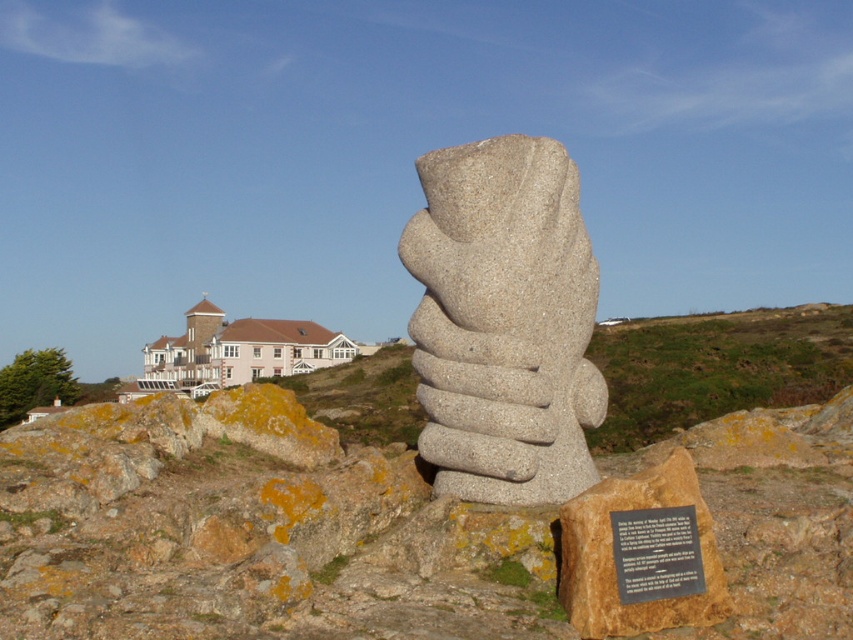
Question: Can you confirm if gray granite sculpture at center is positioned to the right of black paper at center?

Choices:
 (A) no
 (B) yes

Answer: (A)

Question: Can you confirm if gray granite sculpture at center is positioned to the left of black paper at center?

Choices:
 (A) no
 (B) yes

Answer: (B)

Question: Which point is farther from the camera taking this photo?

Choices:
 (A) (641, 577)
 (B) (212, 608)

Answer: (A)

Question: Which is nearer to the brown rock at center?

Choices:
 (A) black paper at center
 (B) gray granite sculpture at center

Answer: (A)

Question: Which object appears farthest from the camera in this image?

Choices:
 (A) black paper at center
 (B) gray granite sculpture at center
 (C) brown rock at center

Answer: (B)

Question: Does gray granite sculpture at center appear over black paper at center?

Choices:
 (A) no
 (B) yes

Answer: (B)